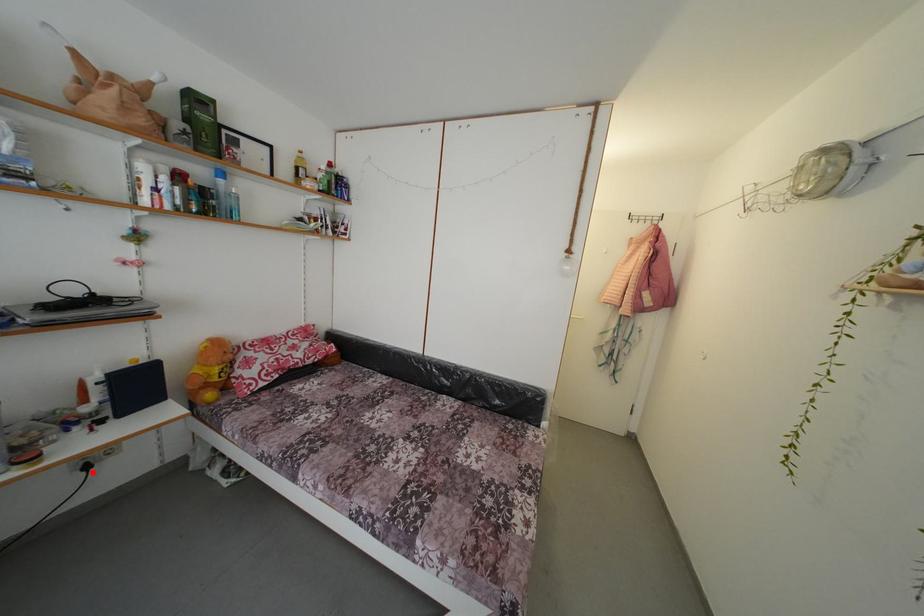
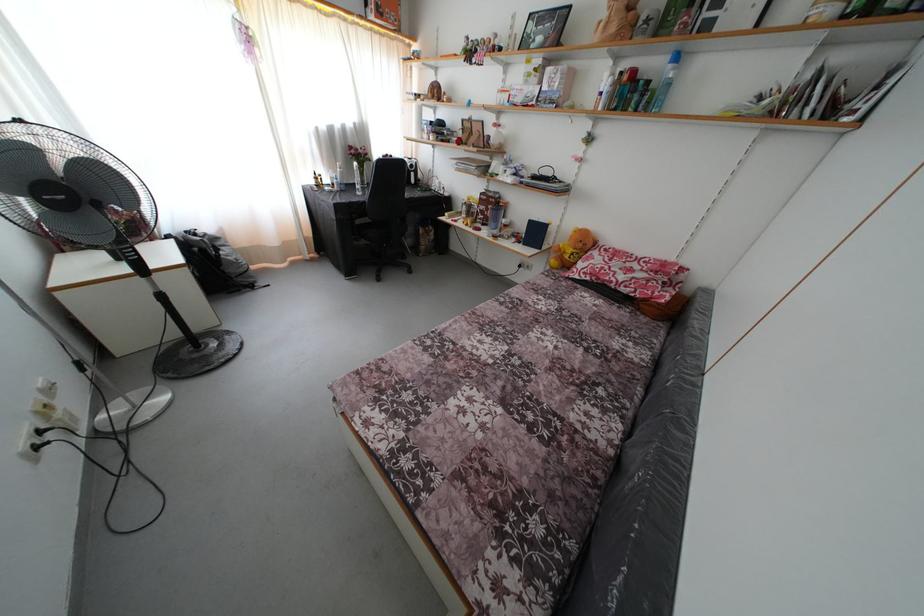
Question: A red point is marked in image1. In image2, is the corresponding 3D point closer to the camera or farther? Reply with the corresponding letter.

Choices:
 (A) The corresponding 3D point is closer.
 (B) The corresponding 3D point is farther.

Answer: (A)